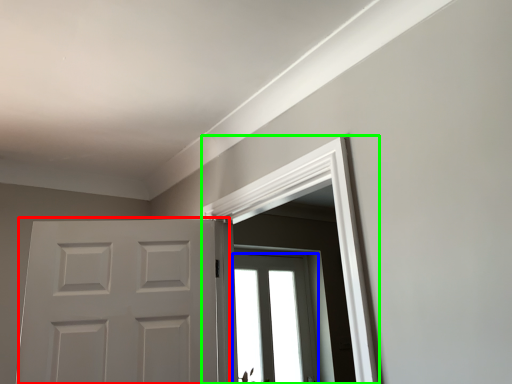
Question: Which object is the farthest from door (highlighted by a red box)? Choose among these: window (highlighted by a blue box) or window frame (highlighted by a green box).

Choices:
 (A) window
 (B) window frame

Answer: (A)